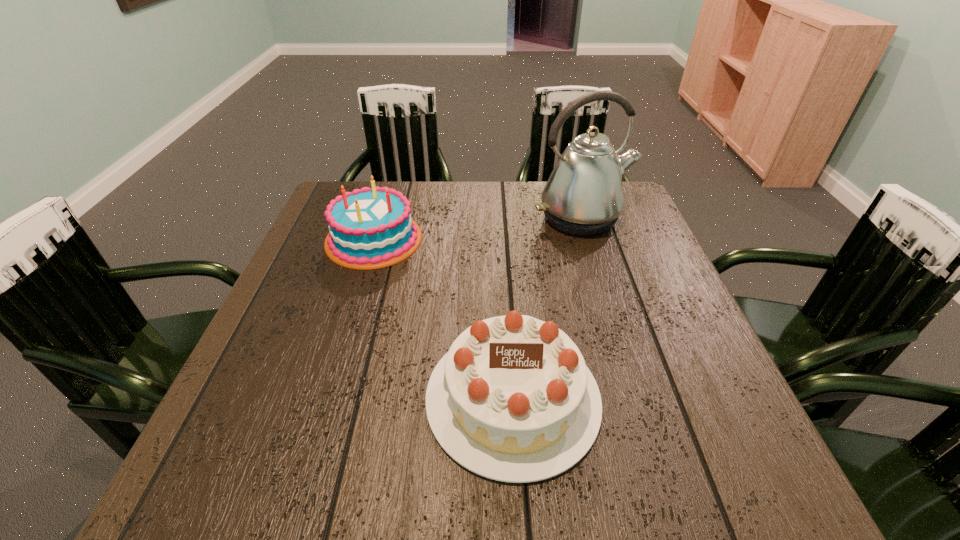
Choose which object is the second nearest neighbor to the right birthday cake. Please provide its 2D coordinates. Your answer should be formatted as a tuple, i.e. [(x, y)], where the tuple contains the x and y coordinates of a point satisfying the conditions above.

[(583, 196)]

Identify which object is the nearest to the nearest object. Please provide its 2D coordinates. Your answer should be formatted as a tuple, i.e. [(x, y)], where the tuple contains the x and y coordinates of a point satisfying the conditions above.

[(367, 229)]

Where is `free space in the image that satisfies the following two spatial constraints: 1. on the front side of the right birthday cake; 2. on the left side of the left birthday cake`? The height and width of the screenshot is (540, 960). free space in the image that satisfies the following two spatial constraints: 1. on the front side of the right birthday cake; 2. on the left side of the left birthday cake is located at coordinates (325, 398).

The image size is (960, 540). In order to click on free location that satisfies the following two spatial constraints: 1. on the back side of the left birthday cake; 2. on the right side of the kettle in this screenshot , I will do `click(380, 219)`.

At what (x,y) coordinates should I click in order to perform the action: click on vacant space that satisfies the following two spatial constraints: 1. on the back side of the kettle; 2. on the right side of the nearer birthday cake. Please return your answer as a coordinate pair (x, y). Looking at the image, I should click on pyautogui.click(x=501, y=219).

What are the coordinates of `vacant space that satisfies the following two spatial constraints: 1. on the back side of the left birthday cake; 2. on the left side of the tallest object` in the screenshot? It's located at (380, 219).

Identify the location of vacant space that satisfies the following two spatial constraints: 1. on the back side of the kettle; 2. on the left side of the leftmost object. (380, 219).